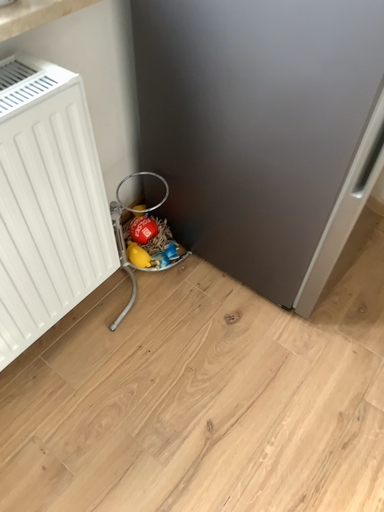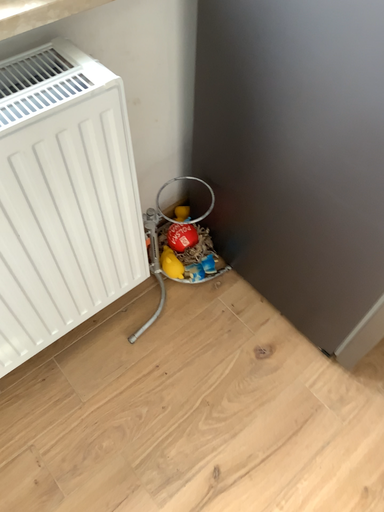
Question: How did the camera likely rotate when shooting the video?

Choices:
 (A) rotated left
 (B) rotated right

Answer: (A)